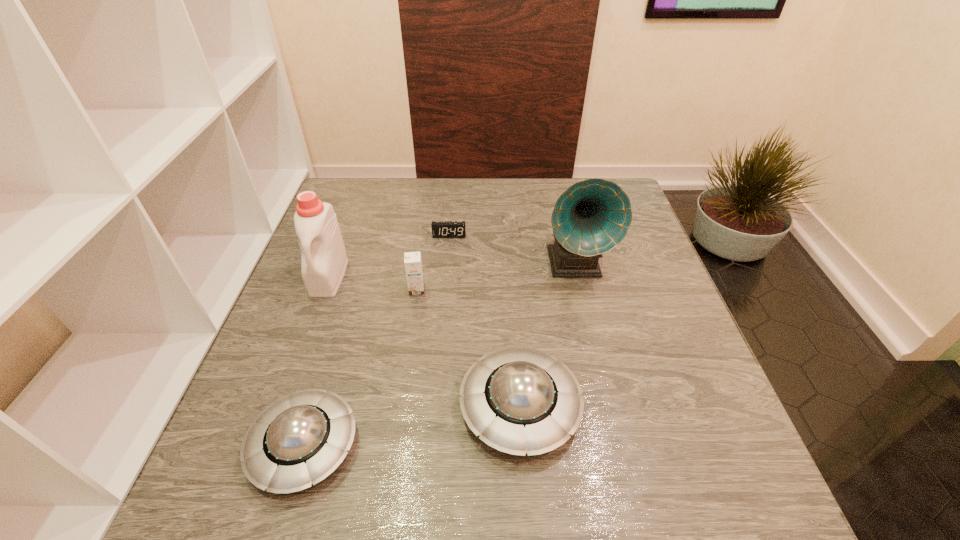
At what (x,y) coordinates should I click in order to perform the action: click on vacant space positioned on the back of the fourth object from right to left. Please return your answer as a coordinate pair (x, y). The image size is (960, 540). Looking at the image, I should click on (420, 265).

At what (x,y) coordinates should I click in order to perform the action: click on free region located on the front-facing side of the alarm clock. Please return your answer as a coordinate pair (x, y). Image resolution: width=960 pixels, height=540 pixels. Looking at the image, I should click on (446, 270).

Find the location of a particular element. Image resolution: width=960 pixels, height=540 pixels. vacant position located from the horn of the tallest object is located at coordinates (599, 368).

Where is `free spot located on the handle side of the second tallest object`? This screenshot has height=540, width=960. free spot located on the handle side of the second tallest object is located at coordinates (283, 400).

Where is `saucer that is at the left edge`? This screenshot has width=960, height=540. saucer that is at the left edge is located at coordinates (298, 440).

Identify the location of detergent at the left edge. Image resolution: width=960 pixels, height=540 pixels. (324, 260).

Find the location of `object that is at the right edge`. object that is at the right edge is located at coordinates (591, 217).

This screenshot has width=960, height=540. I want to click on object that is at the near left corner, so click(298, 440).

Find the location of a particular element. vacant space at the far edge of the desktop is located at coordinates (410, 181).

Where is `blank space at the left edge`? blank space at the left edge is located at coordinates (353, 243).